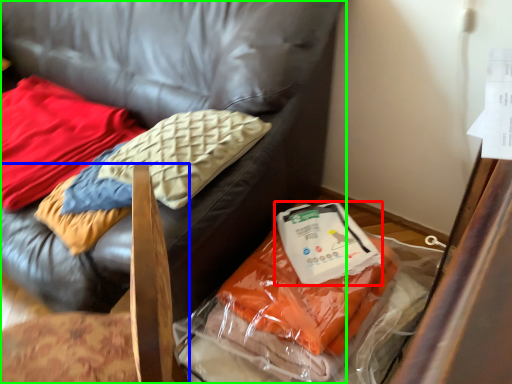
Question: Based on their relative distances, which object is farther from kit (highlighted by a red box)? Choose from furniture (highlighted by a blue box) and furniture (highlighted by a green box).

Choices:
 (A) furniture
 (B) furniture

Answer: (A)